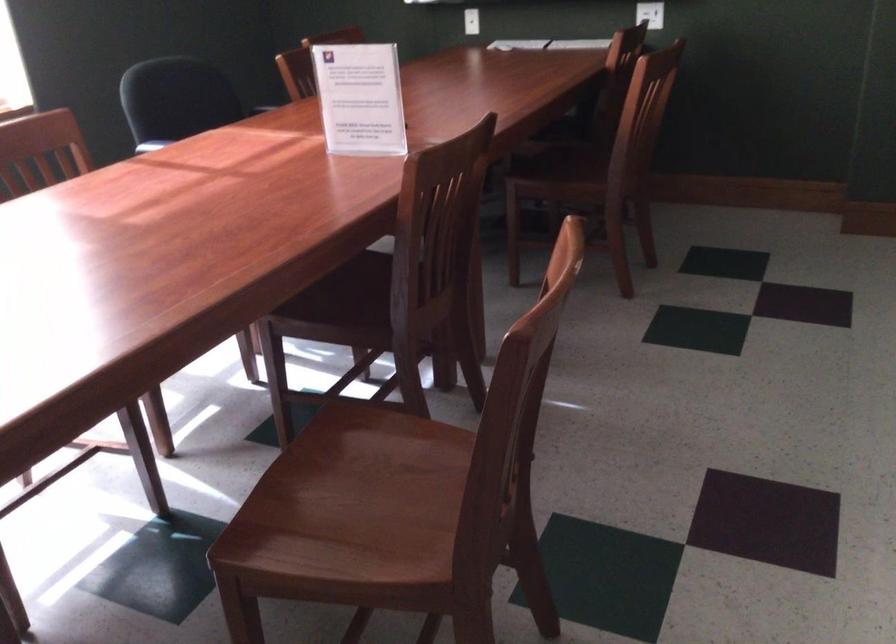
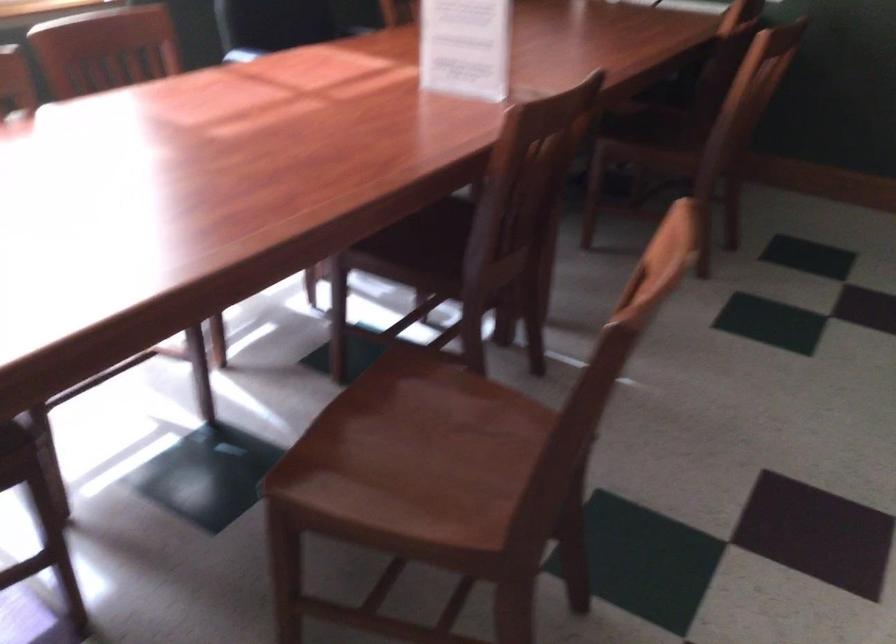
What movement of the cameraman would produce the second image?

The cameraman walked toward left, forward.